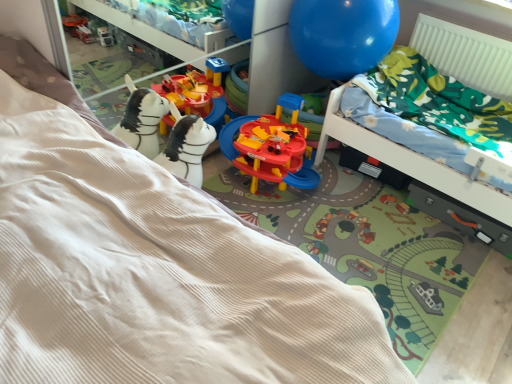
Question: Could you tell me if white ribbed radiator at upper right is turned towards beige corduroy bed at lower left?

Choices:
 (A) no
 (B) yes

Answer: (B)

Question: From the image's perspective, is white ribbed radiator at upper right beneath beige corduroy bed at lower left?

Choices:
 (A) yes
 (B) no

Answer: (B)

Question: From a real-world perspective, is white ribbed radiator at upper right located higher than beige corduroy bed at lower left?

Choices:
 (A) yes
 (B) no

Answer: (A)

Question: From a real-world perspective, is white ribbed radiator at upper right positioned under beige corduroy bed at lower left based on gravity?

Choices:
 (A) no
 (B) yes

Answer: (A)

Question: Considering the relative positions of white ribbed radiator at upper right and beige corduroy bed at lower left in the image provided, is white ribbed radiator at upper right to the right of beige corduroy bed at lower left from the viewer's perspective?

Choices:
 (A) no
 (B) yes

Answer: (B)

Question: Looking at the image, does dark gray plastic drawer at lower right seem bigger or smaller compared to beige corduroy bed at lower left?

Choices:
 (A) small
 (B) big

Answer: (A)

Question: Is dark gray plastic drawer at lower right taller or shorter than beige corduroy bed at lower left?

Choices:
 (A) tall
 (B) short

Answer: (B)

Question: Which is correct: dark gray plastic drawer at lower right is inside beige corduroy bed at lower left, or outside of it?

Choices:
 (A) inside
 (B) outside

Answer: (B)

Question: In the image, is dark gray plastic drawer at lower right positioned in front of or behind beige corduroy bed at lower left?

Choices:
 (A) front
 (B) behind

Answer: (B)

Question: From the image's perspective, is white ribbed radiator at upper right above or below dark gray plastic drawer at lower right?

Choices:
 (A) above
 (B) below

Answer: (A)

Question: Considering their positions, is white ribbed radiator at upper right located in front of or behind dark gray plastic drawer at lower right?

Choices:
 (A) behind
 (B) front

Answer: (A)

Question: Based on their positions, is white ribbed radiator at upper right located to the left or right of dark gray plastic drawer at lower right?

Choices:
 (A) right
 (B) left

Answer: (A)

Question: Looking at their shapes, would you say white ribbed radiator at upper right is wider or thinner than dark gray plastic drawer at lower right?

Choices:
 (A) thin
 (B) wide

Answer: (B)

Question: From a real-world perspective, is beige corduroy bed at lower left above or below dark gray plastic drawer at lower right?

Choices:
 (A) above
 (B) below

Answer: (A)

Question: Is beige corduroy bed at lower left inside or outside of dark gray plastic drawer at lower right?

Choices:
 (A) outside
 (B) inside

Answer: (A)